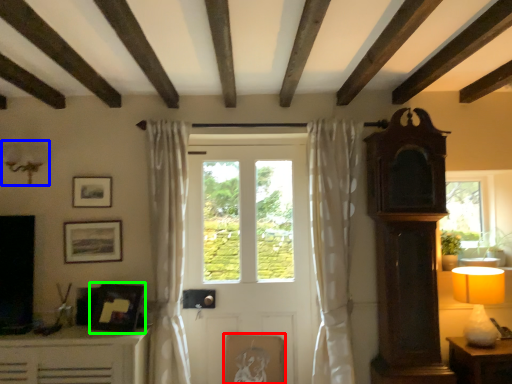
Question: Which is farther away from picture frame (highlighted by a red box)? lamp (highlighted by a blue box) or picture frame (highlighted by a green box)?

Choices:
 (A) lamp
 (B) picture frame

Answer: (A)